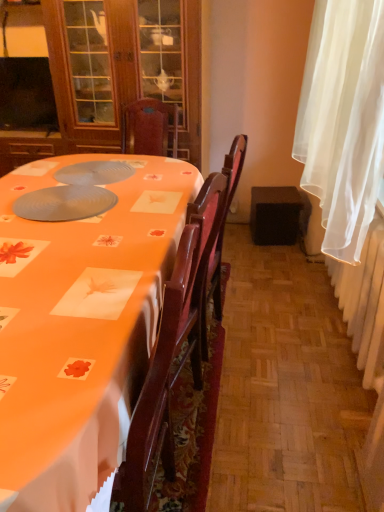
Question: Does black fabric speaker at lower right have a lesser height compared to white sheer curtain at right?

Choices:
 (A) yes
 (B) no

Answer: (A)

Question: From the image's perspective, is black fabric speaker at lower right on top of white sheer curtain at right?

Choices:
 (A) no
 (B) yes

Answer: (A)

Question: Is black fabric speaker at lower right aimed at white sheer curtain at right?

Choices:
 (A) no
 (B) yes

Answer: (A)

Question: Is black fabric speaker at lower right smaller than white sheer curtain at right?

Choices:
 (A) yes
 (B) no

Answer: (A)

Question: Is the position of black fabric speaker at lower right less distant than that of white sheer curtain at right?

Choices:
 (A) yes
 (B) no

Answer: (B)

Question: Based on their positions, is matte wood cabinet at upper left located to the left or right of black fabric speaker at lower right?

Choices:
 (A) left
 (B) right

Answer: (A)

Question: Considering the positions of matte wood cabinet at upper left and black fabric speaker at lower right in the image, is matte wood cabinet at upper left taller or shorter than black fabric speaker at lower right?

Choices:
 (A) tall
 (B) short

Answer: (A)

Question: From a real-world perspective, is matte wood cabinet at upper left above or below black fabric speaker at lower right?

Choices:
 (A) below
 (B) above

Answer: (B)

Question: Considering the positions of point (87, 151) and point (296, 224), is point (87, 151) closer or farther from the camera than point (296, 224)?

Choices:
 (A) closer
 (B) farther

Answer: (A)

Question: Choose the correct answer: Is black fabric speaker at lower right inside white sheer curtain at right or outside it?

Choices:
 (A) outside
 (B) inside

Answer: (A)

Question: Considering the positions of black fabric speaker at lower right and white sheer curtain at right in the image, is black fabric speaker at lower right wider or thinner than white sheer curtain at right?

Choices:
 (A) wide
 (B) thin

Answer: (A)

Question: Is black fabric speaker at lower right bigger or smaller than white sheer curtain at right?

Choices:
 (A) big
 (B) small

Answer: (B)

Question: Relative to white sheer curtain at right, is black fabric speaker at lower right in front or behind?

Choices:
 (A) behind
 (B) front

Answer: (A)

Question: In terms of height, does matte gray paper plate at center look taller or shorter compared to matte wood cabinet at upper left?

Choices:
 (A) tall
 (B) short

Answer: (B)

Question: In terms of width, does matte gray paper plate at center look wider or thinner when compared to matte wood cabinet at upper left?

Choices:
 (A) wide
 (B) thin

Answer: (B)